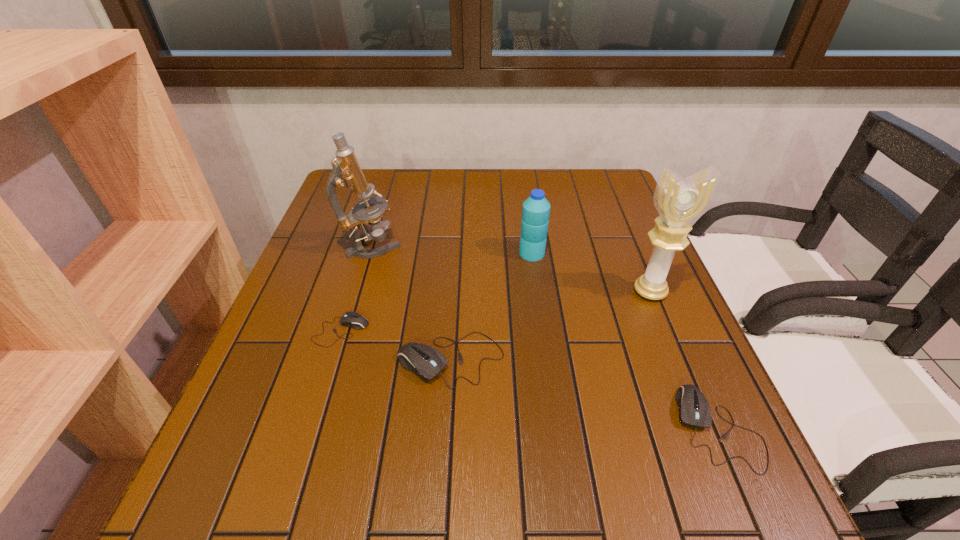
Locate which computer mouse ranks in proximity to the rightmost computer mouse. Please provide its 2D coordinates. Your answer should be formatted as a tuple, i.e. [(x, y)], where the tuple contains the x and y coordinates of a point satisfying the conditions above.

[(427, 362)]

Locate an element on the screen. This screenshot has height=540, width=960. free space that satisfies the following two spatial constraints: 1. on the back side of the third tallest object; 2. on the right side of the second computer mouse from left to right is located at coordinates pos(457,253).

Find the location of `vacant space that satisfies the following two spatial constraints: 1. on the front-facing side of the rightmost computer mouse; 2. on the right side of the fourth nearest object`. vacant space that satisfies the following two spatial constraints: 1. on the front-facing side of the rightmost computer mouse; 2. on the right side of the fourth nearest object is located at coordinates (707, 428).

This screenshot has height=540, width=960. What are the coordinates of `vacant space that satisfies the following two spatial constraints: 1. on the back side of the third object from right to left; 2. on the left side of the third object from left to right` in the screenshot? It's located at (457, 253).

This screenshot has width=960, height=540. What are the coordinates of `free point that satisfies the following two spatial constraints: 1. on the back side of the second computer mouse from left to right; 2. on the right side of the fourth shortest object` in the screenshot? It's located at (457, 253).